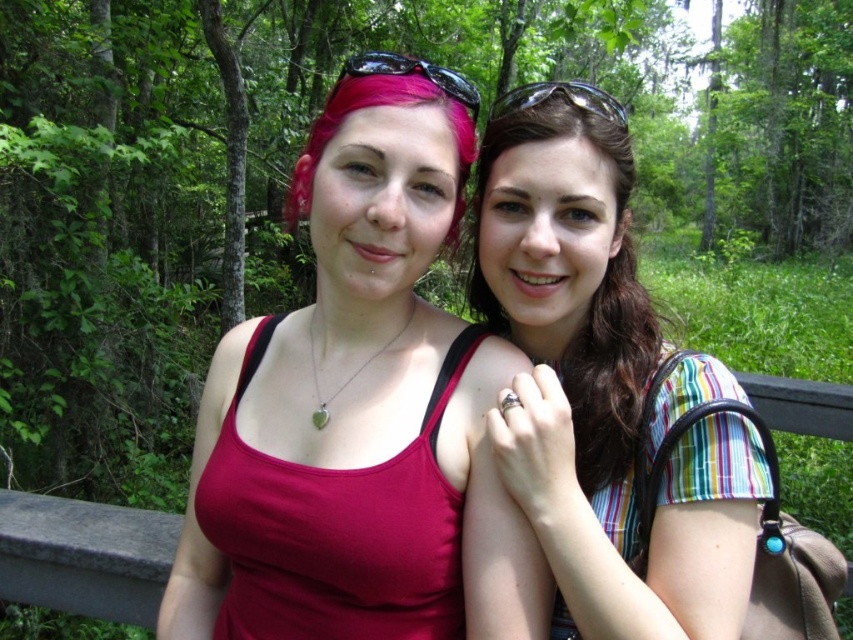
Question: Does striped fabric shirt at right come in front of clear plastic goggles at upper center?

Choices:
 (A) yes
 (B) no

Answer: (A)

Question: Which point is farther to the camera?

Choices:
 (A) pink matte sunglasses at upper center
 (B) clear plastic goggles at upper center
 (C) matte red tank top at center
 (D) striped fabric shirt at right

Answer: (B)

Question: Which point appears farthest from the camera in this image?

Choices:
 (A) (376, 547)
 (B) (424, 72)

Answer: (B)

Question: Can you confirm if matte red tank top at center is positioned above pink matte sunglasses at upper center?

Choices:
 (A) yes
 (B) no

Answer: (B)

Question: Can you confirm if striped fabric shirt at right is positioned to the right of pink matte sunglasses at upper center?

Choices:
 (A) yes
 (B) no

Answer: (A)

Question: Which of the following is the farthest from the observer?

Choices:
 (A) (474, 109)
 (B) (312, 355)
 (C) (495, 109)
 (D) (567, 164)

Answer: (C)